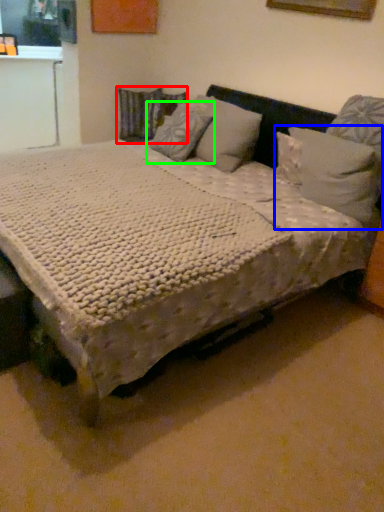
Question: Estimate the real-world distances between objects in this image. Which object is farther from pillow (highlighted by a red box), pillow (highlighted by a blue box) or pillow (highlighted by a green box)?

Choices:
 (A) pillow
 (B) pillow

Answer: (A)